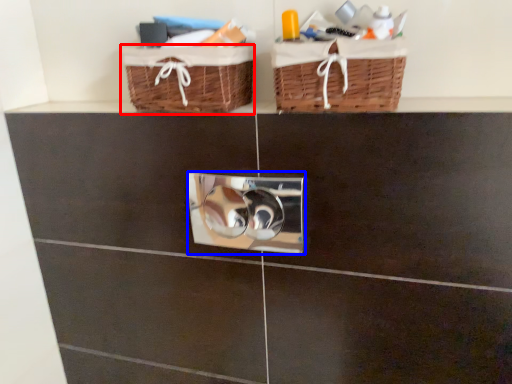
Question: Which object is further to the camera taking this photo, basket (highlighted by a red box) or lock (highlighted by a blue box)?

Choices:
 (A) basket
 (B) lock

Answer: (B)